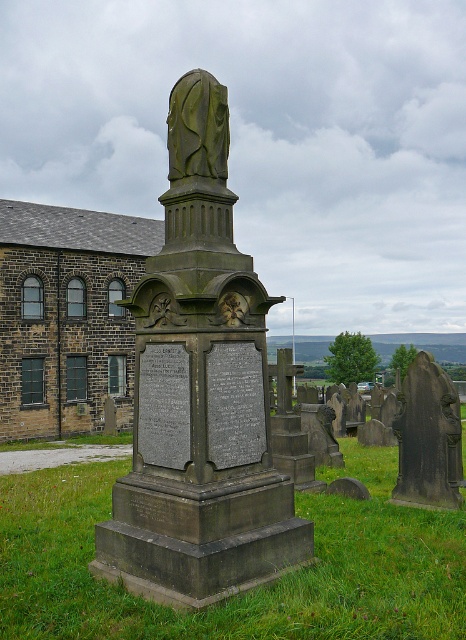
Question: Considering the relative positions of dark gray stone monument at center and green grass at center in the image provided, where is dark gray stone monument at center located with respect to green grass at center?

Choices:
 (A) right
 (B) left

Answer: (B)

Question: Is dark gray stone monument at center to the right of green grass at center from the viewer's perspective?

Choices:
 (A) yes
 (B) no

Answer: (B)

Question: Can you confirm if dark gray stone monument at center is bigger than green grass at center?

Choices:
 (A) no
 (B) yes

Answer: (B)

Question: Among these objects, which one is nearest to the camera?

Choices:
 (A) green grass at center
 (B) dark gray stone monument at center

Answer: (A)